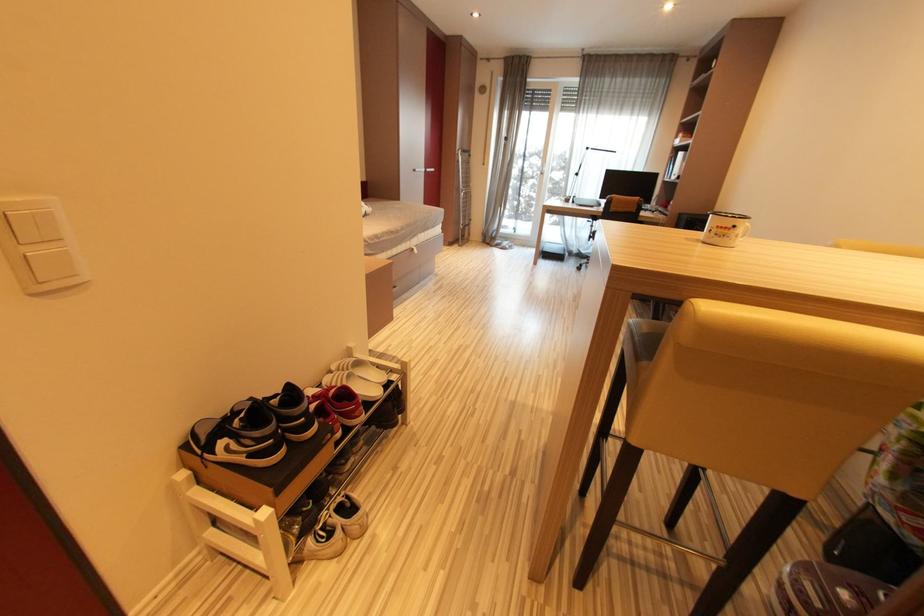
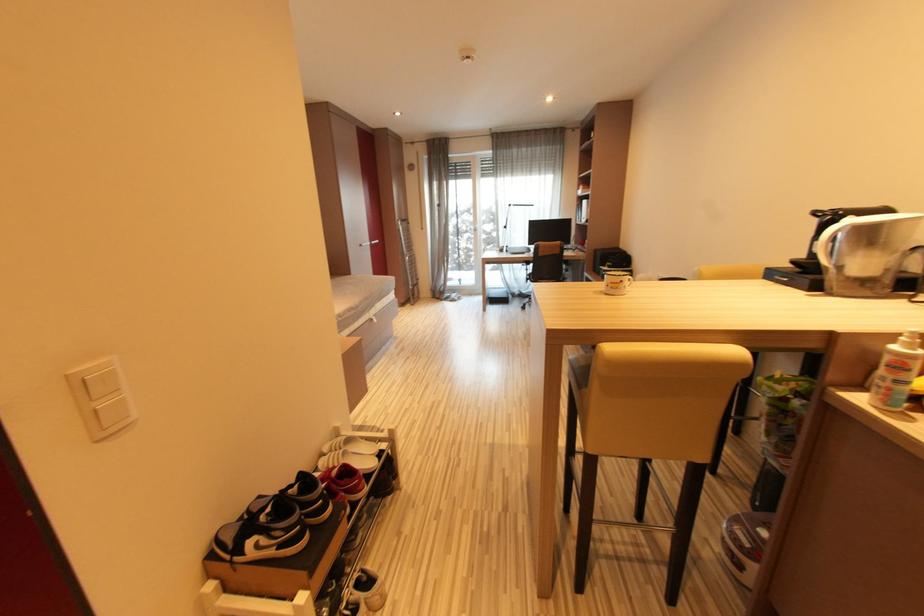
Question: The camera is either moving clockwise (left) or counter-clockwise (right) around the object. The first image is from the beginning of the video and the second image is from the end. Is the camera moving left or right when shooting the video?

Choices:
 (A) Left
 (B) Right

Answer: (A)